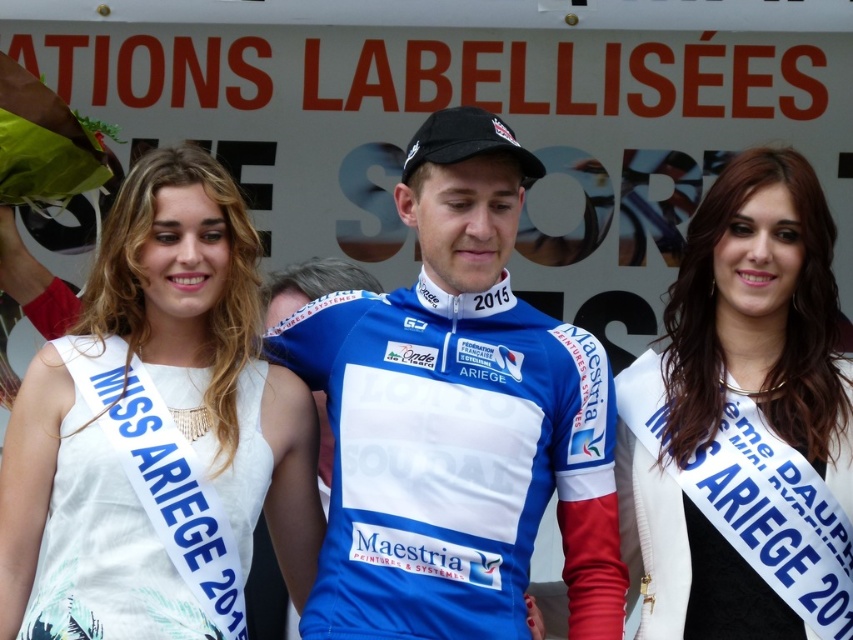
Is point (399, 564) less distant than point (129, 506)?

No, (399, 564) is further to viewer.

Describe the element at coordinates (457, 419) in the screenshot. This screenshot has width=853, height=640. I see `blue jersey at center` at that location.

Locate an element on the screen. blue jersey at center is located at coordinates (457, 419).

Can you confirm if white satin sash at right is positioned below white fabric dress at center?

No.

Does point (822, 557) come in front of point (234, 634)?

No, it is behind (234, 634).

This screenshot has height=640, width=853. In order to click on white satin sash at right in this screenshot , I will do `click(743, 422)`.

Is white satin sash at left to the left of white satin sash at right from the viewer's perspective?

Correct, you'll find white satin sash at left to the left of white satin sash at right.

Which is more to the left, white satin sash at left or white satin sash at right?

white satin sash at left is more to the left.

Between point (212, 428) and point (706, 468), which one is positioned in front?

Point (212, 428) is more forward.

The height and width of the screenshot is (640, 853). Identify the location of white satin sash at left. (155, 432).